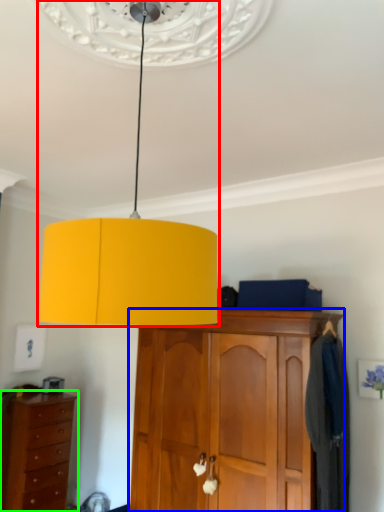
Question: Considering the real-world distances, which object is closest to lamp (highlighted by a red box)? cabinetry (highlighted by a blue box) or chest of drawers (highlighted by a green box).

Choices:
 (A) cabinetry
 (B) chest of drawers

Answer: (A)